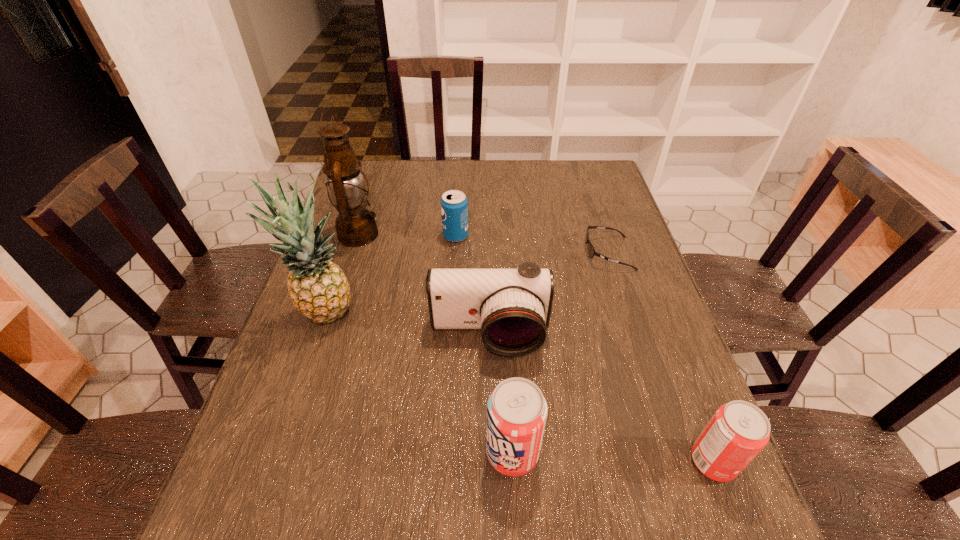
This screenshot has width=960, height=540. Identify the location of the second soda can from right to left. tap(516, 410).

Where is `the rightmost soda can`? the rightmost soda can is located at coordinates (738, 431).

Find the location of a particular element. the leftmost soda can is located at coordinates (454, 205).

What are the coordinates of `oil lamp` in the screenshot? It's located at (355, 226).

At what (x,y) coordinates should I click in order to perform the action: click on sunglasses. Please return your answer as a coordinate pair (x, y). This screenshot has width=960, height=540. Looking at the image, I should click on (591, 251).

The width and height of the screenshot is (960, 540). Identify the location of pineapple. (318, 288).

This screenshot has width=960, height=540. Find the location of `camcorder`. camcorder is located at coordinates (512, 307).

Where is `vacant space located 0.160m on the back of the tallest soda can`? vacant space located 0.160m on the back of the tallest soda can is located at coordinates (508, 362).

Find the location of a particular element. The height and width of the screenshot is (540, 960). vacant space located on the back of the rightmost soda can is located at coordinates (673, 357).

This screenshot has width=960, height=540. Identify the location of free space located 0.220m on the front of the leftmost soda can. (452, 299).